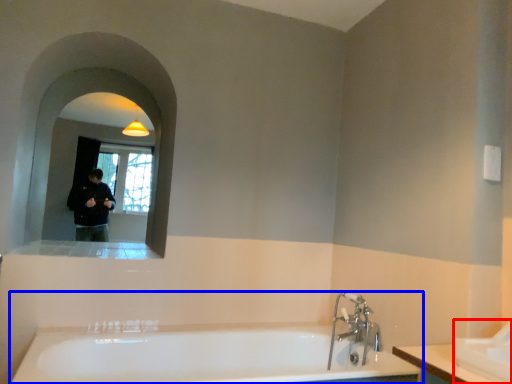
Question: Which of the following is the farthest to the observer, sink (highlighted by a red box) or bathtub (highlighted by a blue box)?

Choices:
 (A) sink
 (B) bathtub

Answer: (B)